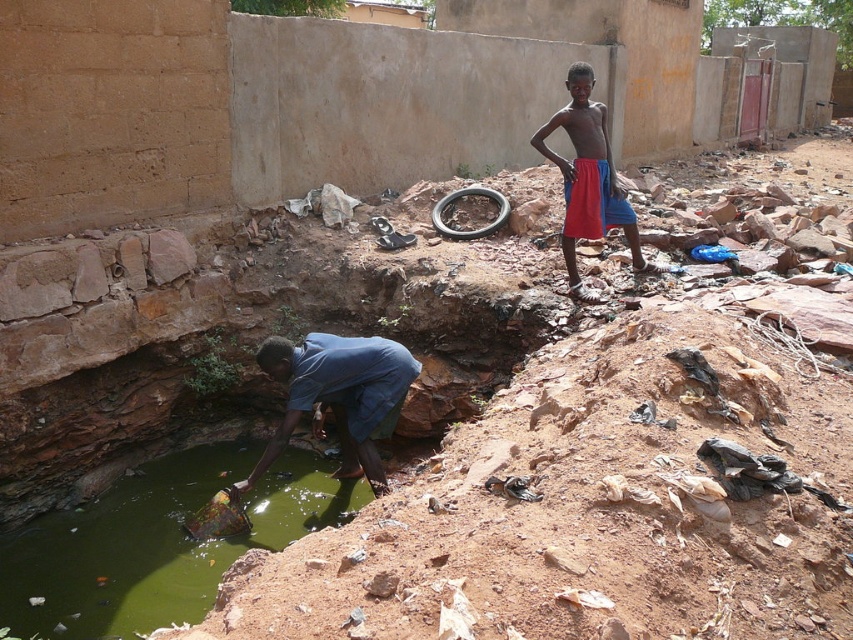
You are a drone operator trying to capture a photo of the man and the boy in the scene. The green murky water at lower left is at point 0.848, 0.185. Where should you position your drone to ensure both the man and the boy are in the frame?

To capture both the man and the boy in the frame, position the drone so that the green murky water at lower left is at point (157,541). This will ensure the man, who is near the water, and the boy in the background are both visible.

You are a photographer standing at the scene. You want to capture a closeup shot of the red fabric shorts at upper right. Considering your current position, can you estimate how far you need to move forward to get the subject within your camera frame?

The red fabric shorts at upper right is 5.94 meters away from viewer. To capture a closeup, you would need to move closer to reduce the distance. However, the exact distance to move depends on your camera lens and desired framing, but the subject is currently 5.94 meters away.